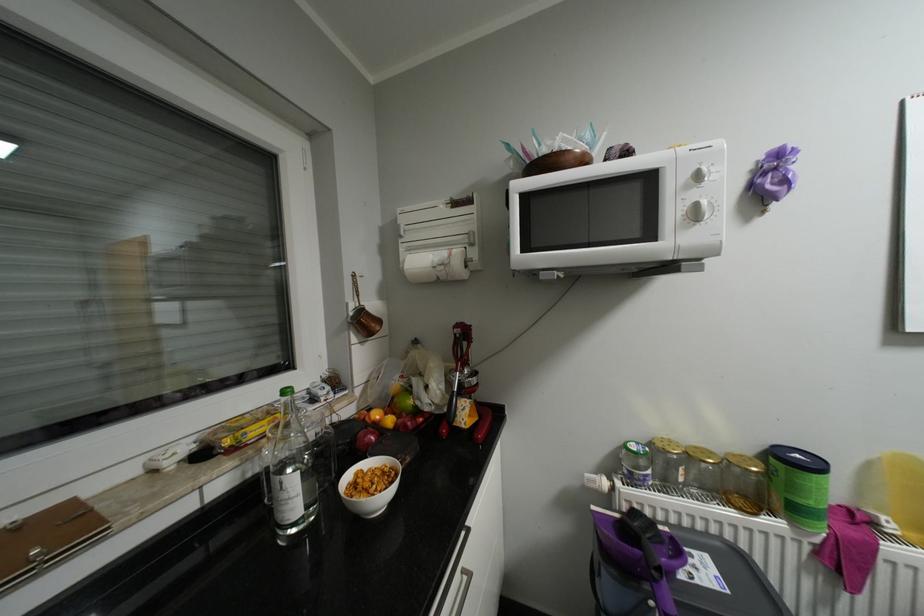
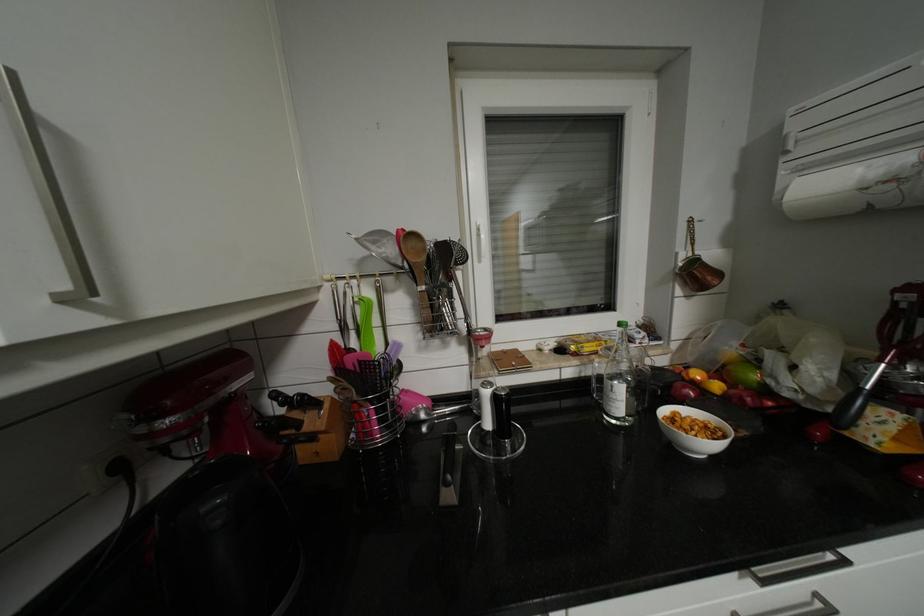
Where in the second image is the point corresponding to [473,577] from the first image?

(827, 604)